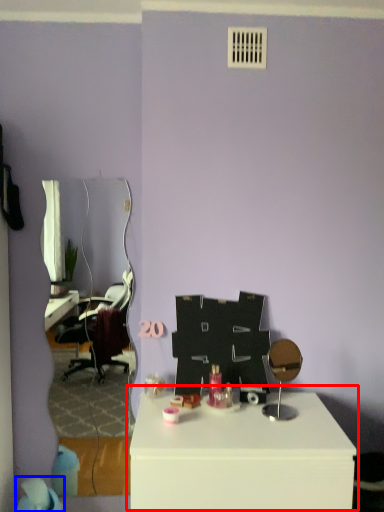
Question: Which object appears closest to the camera in this image, table (highlighted by a red box) or bean bag chair (highlighted by a blue box)?

Choices:
 (A) table
 (B) bean bag chair

Answer: (A)